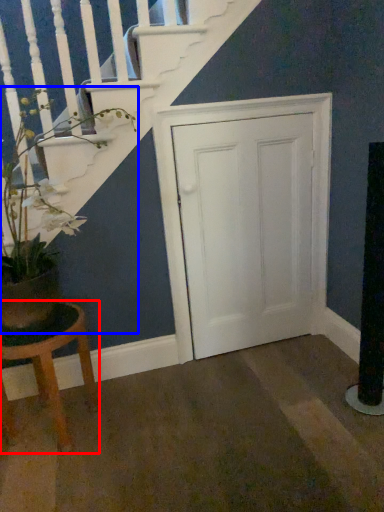
Question: Which object appears farthest to the camera in this image, stool (highlighted by a red box) or houseplant (highlighted by a blue box)?

Choices:
 (A) stool
 (B) houseplant

Answer: (A)